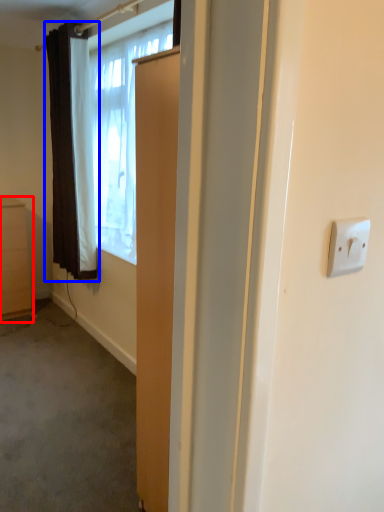
Question: Which point is further to the camera, cabinetry (highlighted by a red box) or curtain (highlighted by a blue box)?

Choices:
 (A) cabinetry
 (B) curtain

Answer: (A)